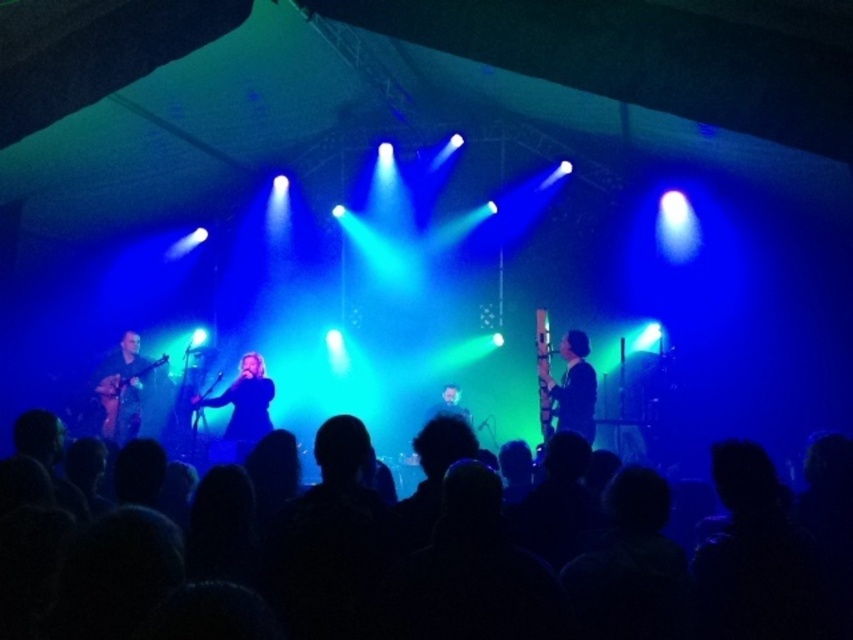
Question: Is black silhouettes at lower center below black matte shirt at center?

Choices:
 (A) no
 (B) yes

Answer: (B)

Question: Which object appears closest to the camera in this image?

Choices:
 (A) black silhouettes at lower center
 (B) shiny brown guitar at left

Answer: (A)

Question: Does dark blue fabric at center appear on the left side of shiny brown guitar at left?

Choices:
 (A) no
 (B) yes

Answer: (A)

Question: Which object is closer to the camera taking this photo?

Choices:
 (A) smooth white head at center
 (B) dark blue fabric at center
 (C) black silhouettes at lower center
 (D) shiny brown guitar at left

Answer: (C)

Question: Can you confirm if black matte shirt at center is positioned to the right of smooth white head at center?

Choices:
 (A) yes
 (B) no

Answer: (A)

Question: Which of the following is the closest to the observer?

Choices:
 (A) (461, 406)
 (B) (256, 400)
 (C) (86, 576)
 (D) (117, 385)

Answer: (C)